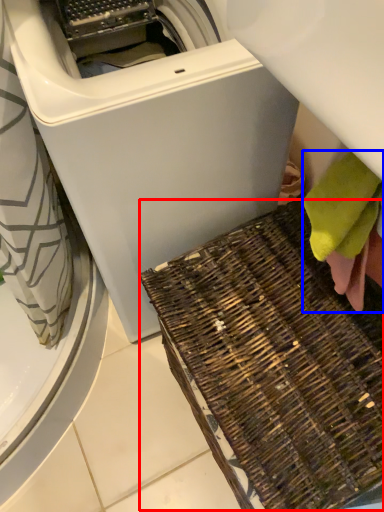
Question: Among these objects, which one is farthest to the camera, waste (highlighted by a red box) or bath towel (highlighted by a blue box)?

Choices:
 (A) waste
 (B) bath towel

Answer: (B)